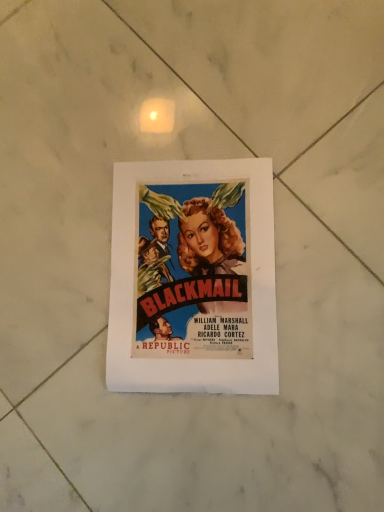
What are the coordinates of `blank area to the left of matte paper poster at center` in the screenshot? It's located at [66, 362].